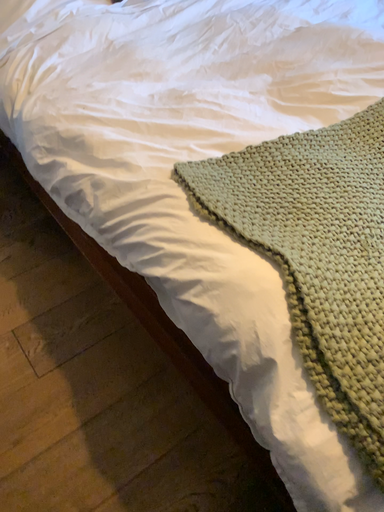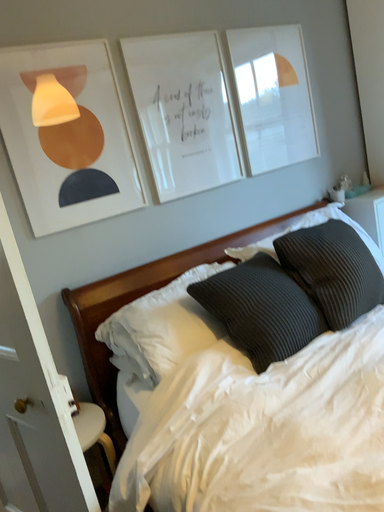
Question: Which way did the camera rotate in the video?

Choices:
 (A) rotated downward
 (B) rotated upward

Answer: (B)